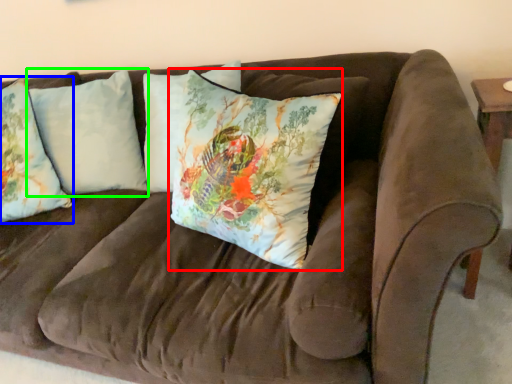
Question: Considering the real-world distances, which object is closest to pillow (highlighted by a red box)? pillow (highlighted by a blue box) or pillow (highlighted by a green box).

Choices:
 (A) pillow
 (B) pillow

Answer: (B)